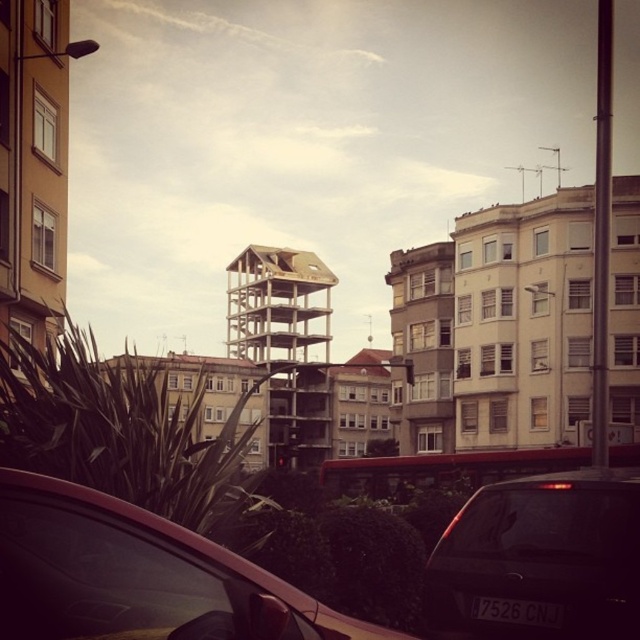
Question: Can you confirm if white matte building at center is positioned above wooden scaffolding at center?

Choices:
 (A) yes
 (B) no

Answer: (A)

Question: Is white matte building at center bigger than wooden scaffolding at center?

Choices:
 (A) no
 (B) yes

Answer: (A)

Question: Which of the following is the farthest from the observer?

Choices:
 (A) black matte car at lower right
 (B) white matte building at center
 (C) wooden scaffolding at center
 (D) matte red car at lower left

Answer: (C)

Question: Which point is closer to the camera?

Choices:
 (A) (484, 314)
 (B) (42, 545)
 (C) (580, 492)

Answer: (B)

Question: Can you confirm if white matte building at center is positioned to the right of black matte car at lower right?

Choices:
 (A) no
 (B) yes

Answer: (B)

Question: Among these points, which one is farthest from the camera?

Choices:
 (A) (88, 561)
 (B) (480, 426)
 (C) (324, 288)

Answer: (C)